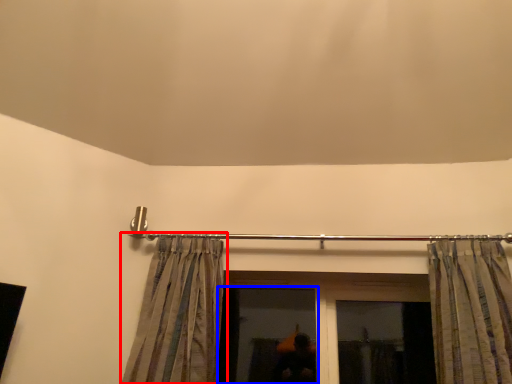
Question: Among these objects, which one is nearest to the camera, curtain (highlighted by a red box) or window (highlighted by a blue box)?

Choices:
 (A) curtain
 (B) window

Answer: (A)